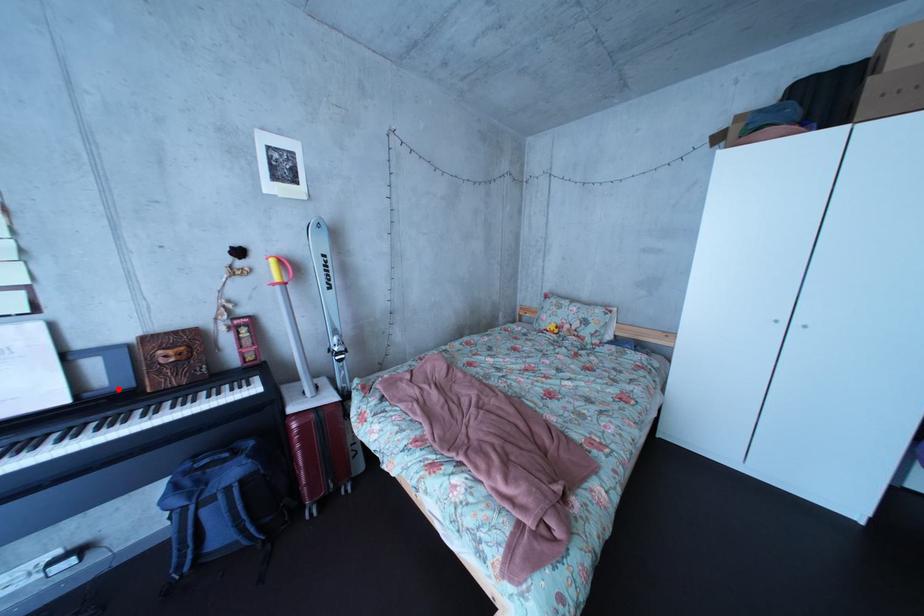
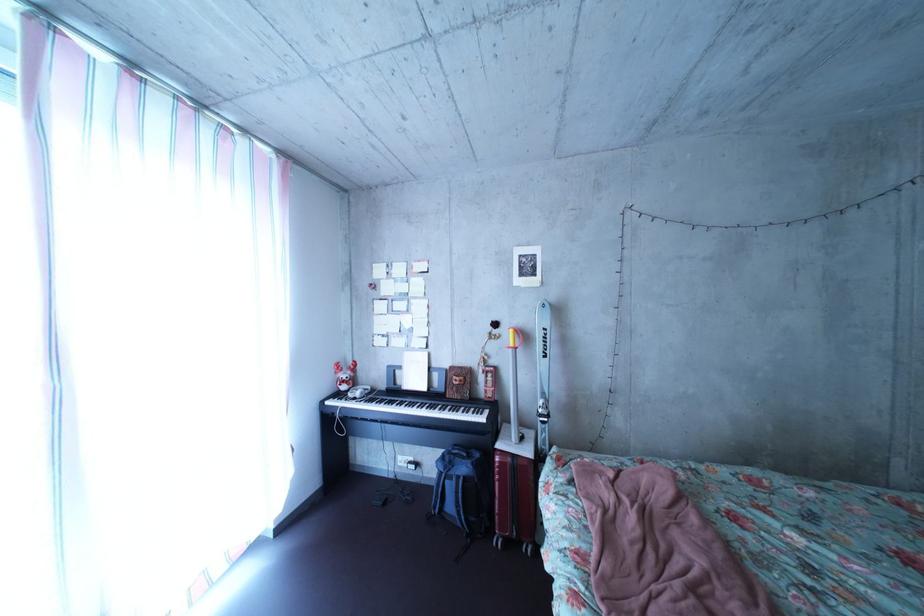
Question: I am providing you with two images of the same scene from different viewpoints. Image1 has a red point marked. In image2, the corresponding 3D location appears at what relative position? Reply with the corresponding letter.

Choices:
 (A) Closer
 (B) Farther

Answer: (B)